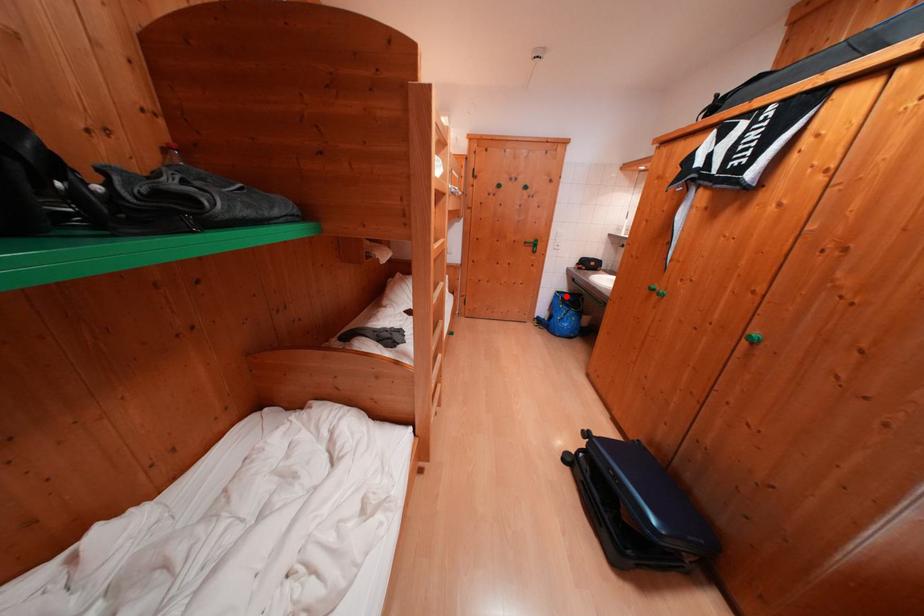
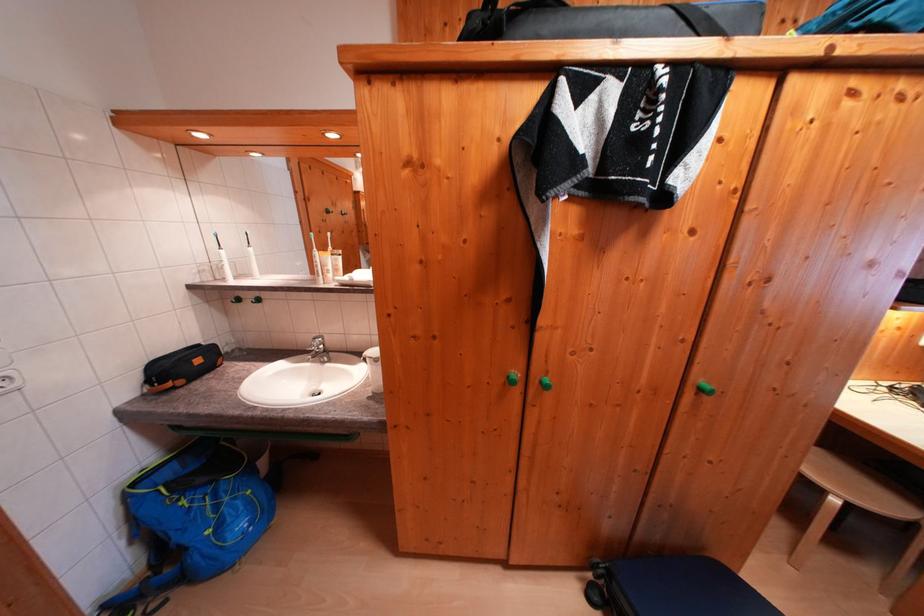
In the second image, find the point that corresponds to the highlighted location in the first image.

(142, 488)